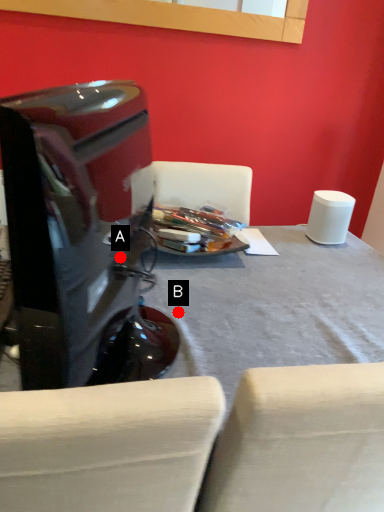
Question: Two points are circled on the image, labeled by A and B beside each circle. Among these points, which one is farthest from the camera?

Choices:
 (A) A is further
 (B) B is further

Answer: (A)